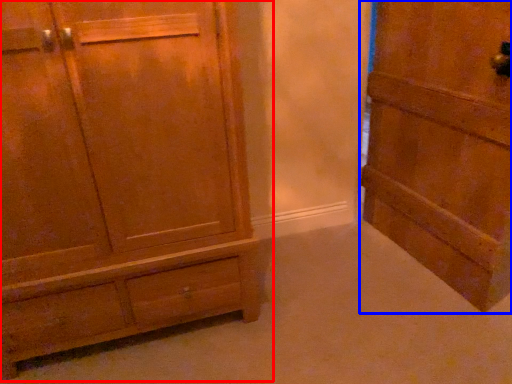
Question: Among these objects, which one is farthest to the camera, chest of drawers (highlighted by a red box) or door (highlighted by a blue box)?

Choices:
 (A) chest of drawers
 (B) door

Answer: (B)